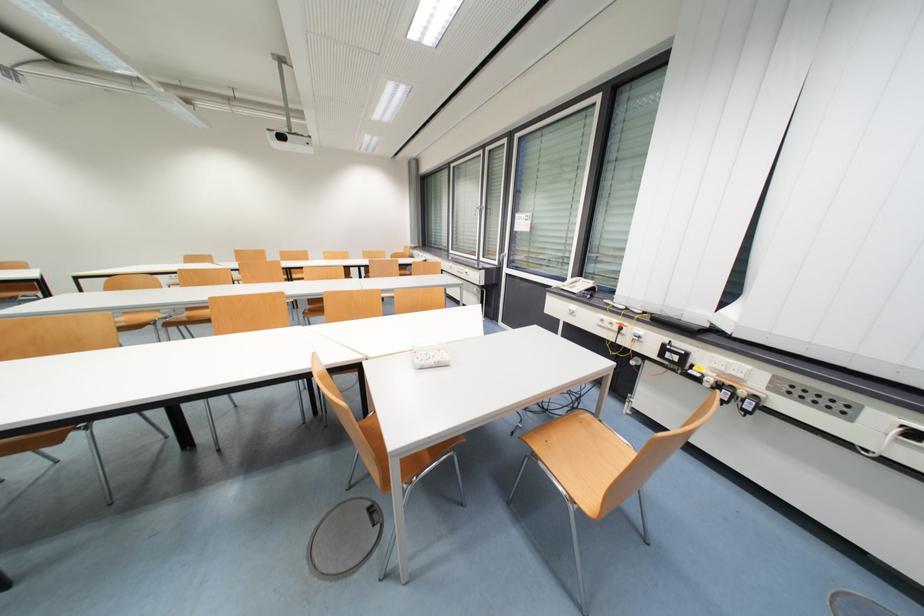
What do you see at coordinates (281, 136) in the screenshot? Image resolution: width=924 pixels, height=616 pixels. I see `a red emergency button` at bounding box center [281, 136].